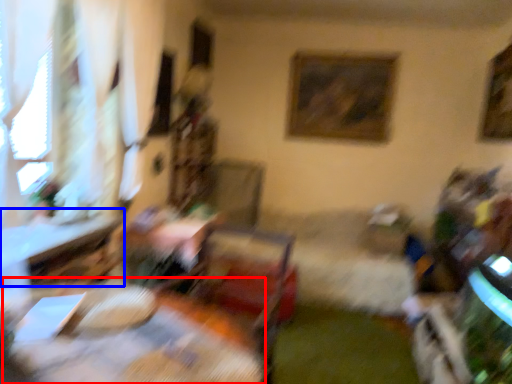
Question: Among these objects, which one is farthest to the camera, table (highlighted by a red box) or table (highlighted by a blue box)?

Choices:
 (A) table
 (B) table

Answer: (B)